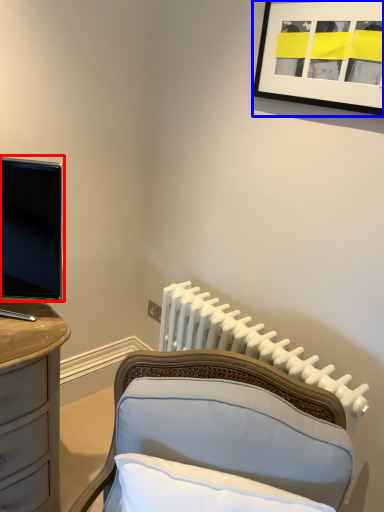
Question: Which of the following is the farthest to the observer, television (highlighted by a red box) or picture frame (highlighted by a blue box)?

Choices:
 (A) television
 (B) picture frame

Answer: (B)